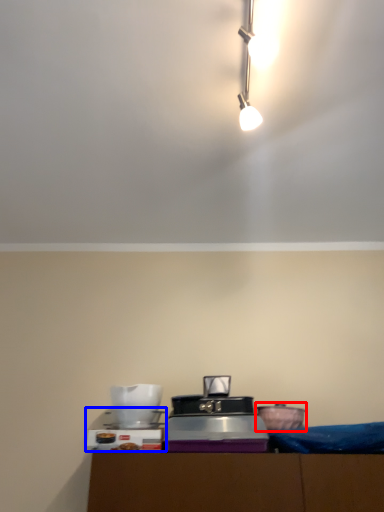
Question: Among these objects, which one is nearest to the camera, appliance (highlighted by a red box) or appliance (highlighted by a blue box)?

Choices:
 (A) appliance
 (B) appliance

Answer: (B)